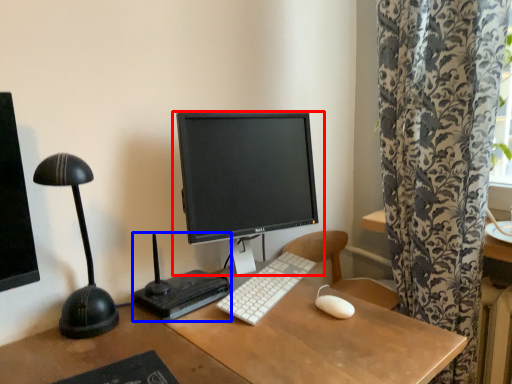
Question: Among these objects, which one is nearest to the camera, computer monitor (highlighted by a red box) or equipment (highlighted by a blue box)?

Choices:
 (A) computer monitor
 (B) equipment

Answer: (B)